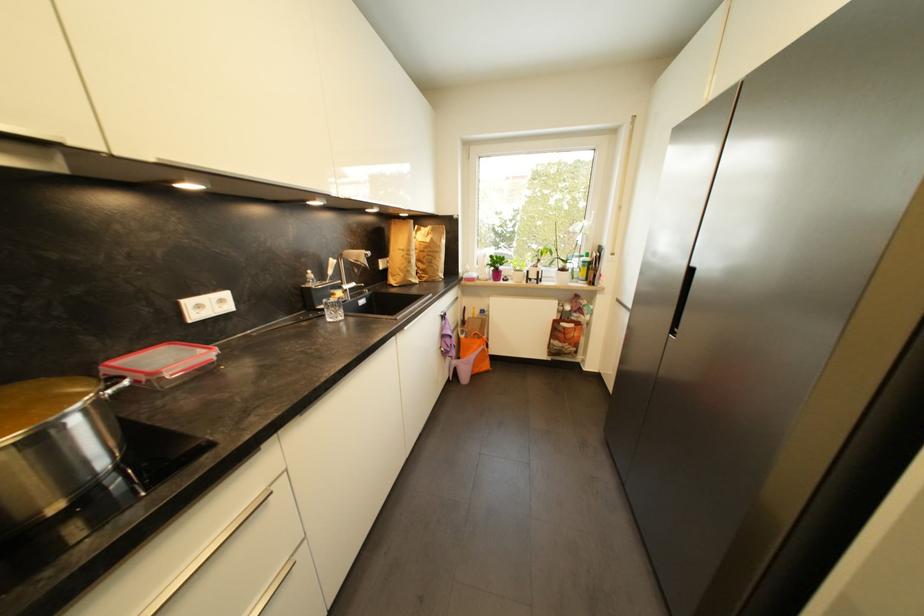
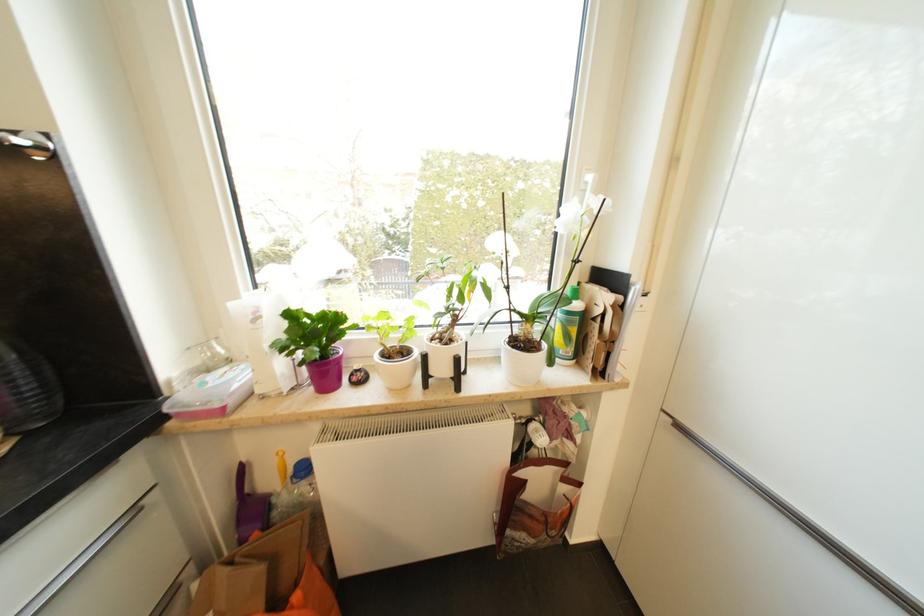
Find the pixel in the second image that matches the point at 495,257 in the first image.

(295, 317)